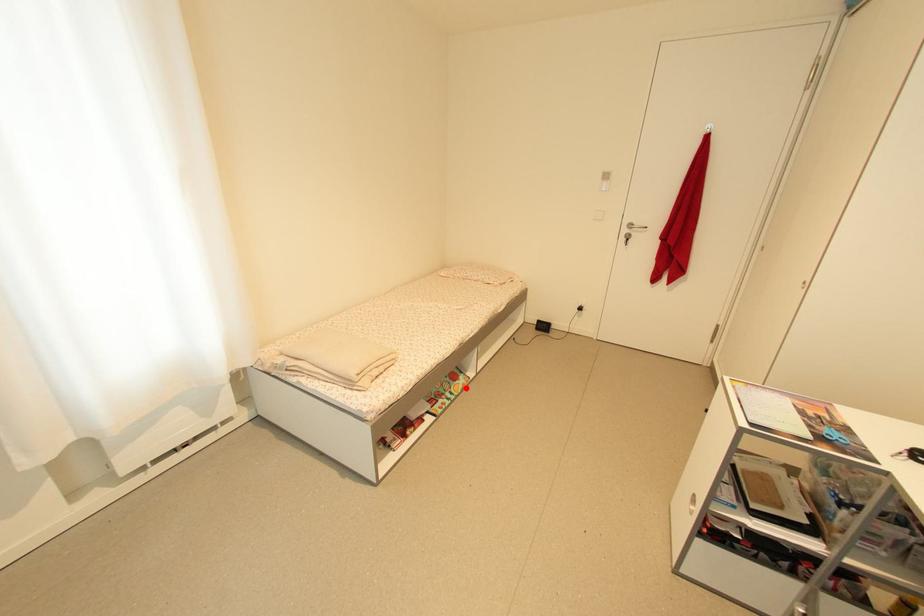
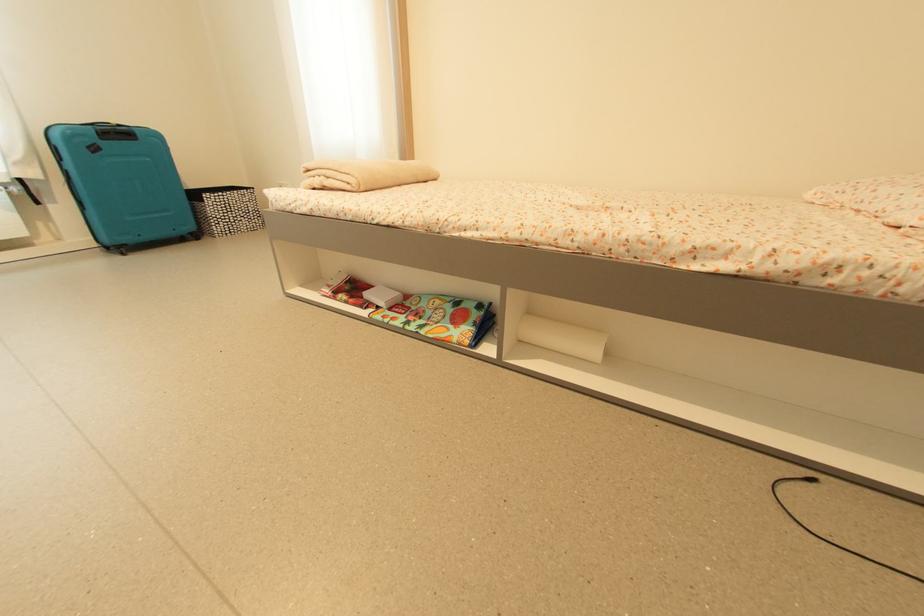
The point at the highlighted location is marked in the first image. Where is the corresponding point in the second image?

(447, 337)